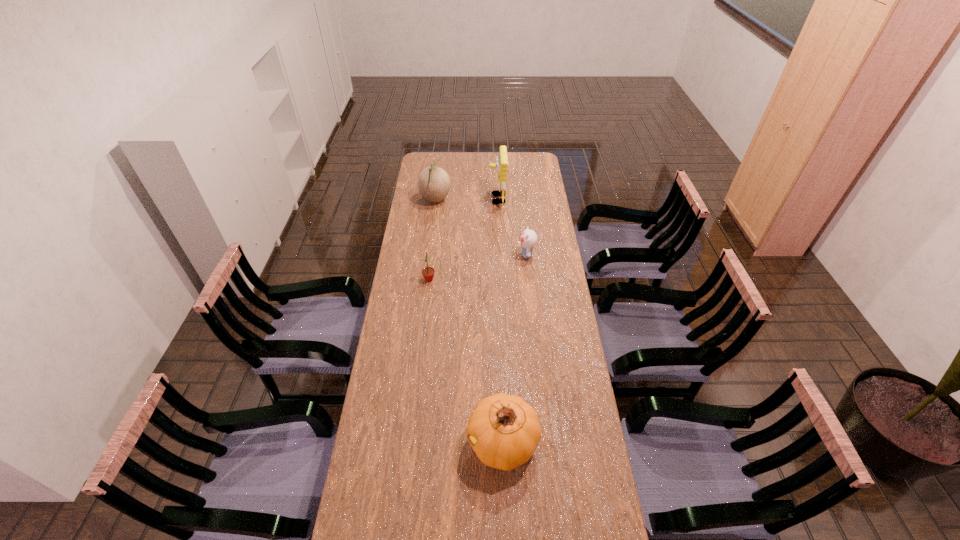
This screenshot has height=540, width=960. I want to click on free space between the sponge and the pumpkin, so click(x=500, y=321).

Locate an element on the screen. Image resolution: width=960 pixels, height=540 pixels. free area in between the pumpkin and the kitten is located at coordinates (515, 348).

This screenshot has height=540, width=960. Identify the location of empty location between the fourth tallest object and the shortest object. (478, 267).

Where is `vacant region between the cantaloup and the fourth tallest object`? The image size is (960, 540). vacant region between the cantaloup and the fourth tallest object is located at coordinates (432, 240).

Point out which object is positioned as the nearest to the cantaloup. Please provide its 2D coordinates. Your answer should be formatted as a tuple, i.e. [(x, y)], where the tuple contains the x and y coordinates of a point satisfying the conditions above.

[(501, 165)]

This screenshot has width=960, height=540. What are the coordinates of `the second closest object to the nearest object` in the screenshot? It's located at (528, 238).